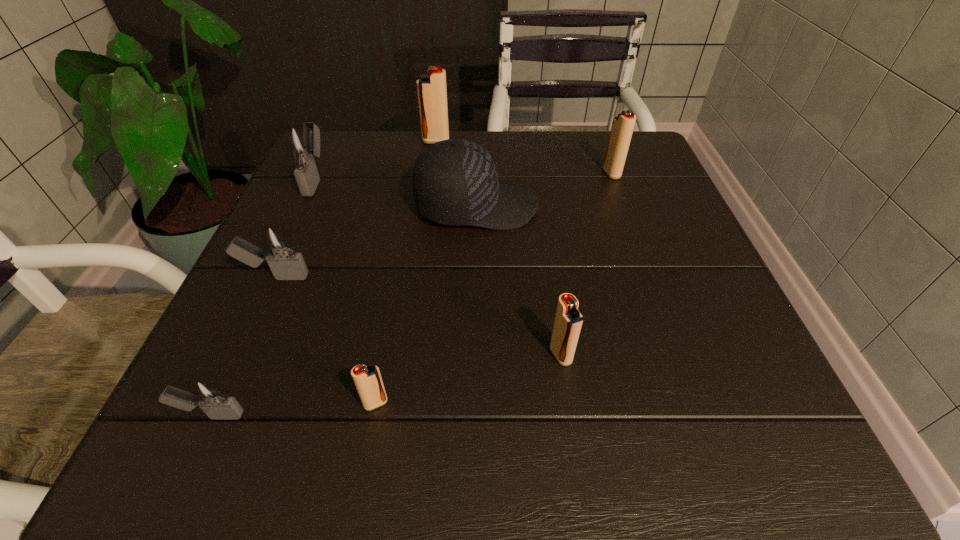
In the image, there is a desktop. Find the location of `vacant space at the near left corner`. vacant space at the near left corner is located at coordinates (292, 417).

Where is `free region at the near right corner`? free region at the near right corner is located at coordinates (717, 428).

Find the location of `unoccupied position between the rightmost object and the nearest red igniter`. unoccupied position between the rightmost object and the nearest red igniter is located at coordinates (493, 288).

The height and width of the screenshot is (540, 960). I want to click on free space between the baseball cap and the biggest gray igniter, so click(396, 193).

Locate an element on the screen. This screenshot has height=540, width=960. free area in between the baseball cap and the nearest gray igniter is located at coordinates (344, 311).

Identify the location of free space that is in between the second nearest red igniter and the fourth farthest igniter. The height and width of the screenshot is (540, 960). (419, 316).

You are a GUI agent. You are given a task and a screenshot of the screen. Output one action in this format:
    pyautogui.click(x=<x>, y=<y>)
    Task: Click on the free space that is in between the smallest red igniter and the baseball cap
    This screenshot has width=960, height=540.
    Given the screenshot: What is the action you would take?
    pyautogui.click(x=426, y=305)

I want to click on vacant space that's between the second red igniter from right to left and the baseball cap, so tap(518, 281).

The width and height of the screenshot is (960, 540). What are the coordinates of `vacant space that's between the fourth nearest igniter and the second smallest red igniter` in the screenshot? It's located at (419, 316).

The image size is (960, 540). I want to click on vacant space that is in between the farthest gray igniter and the baseball cap, so click(x=396, y=193).